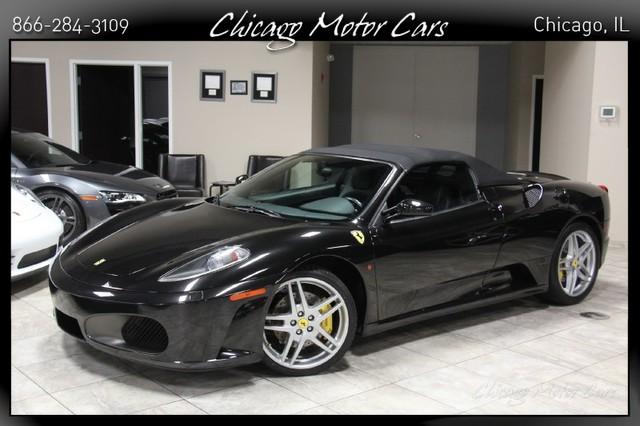
The image size is (640, 426). Find the location of `framed items on wall`. framed items on wall is located at coordinates (205, 83), (242, 86), (264, 83).